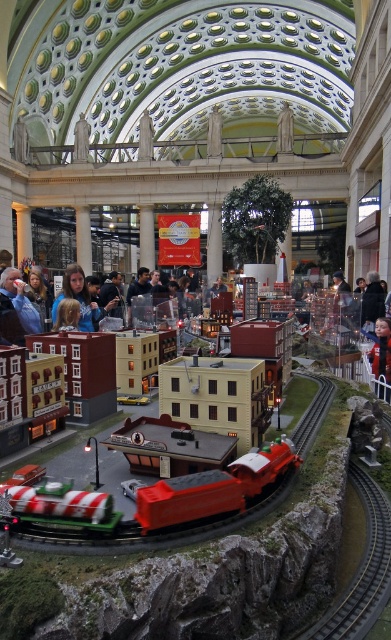
Who is higher up, shiny red train at center or blue denim jacket at left?

blue denim jacket at left

Does shiny red train at center have a larger size compared to blue denim jacket at left?

Actually, shiny red train at center might be smaller than blue denim jacket at left.

This screenshot has height=640, width=391. In order to click on shiny red train at center in this screenshot , I will do `click(150, 502)`.

Who is more forward, (x=292, y=451) or (x=367, y=493)?

Positioned in front is point (x=292, y=451).

Can you confirm if shiny red train at center is positioned to the right of metallic silver train track at lower right?

No, shiny red train at center is not to the right of metallic silver train track at lower right.

Does point (157, 492) come farther from viewer compared to point (376, 522)?

No, it is in front of (376, 522).

Identify the location of shiny red train at center. Image resolution: width=391 pixels, height=640 pixels. (150, 502).

Who is more distant from viewer, (290,448) or (87,296)?

Positioned behind is point (87,296).

Locate an element on the screen. This screenshot has height=640, width=391. shiny red train at center is located at coordinates (150, 502).

Is point (132, 541) closer to viewer compared to point (71, 276)?

Yes, it is.

The image size is (391, 640). I want to click on shiny red train at center, so click(x=150, y=502).